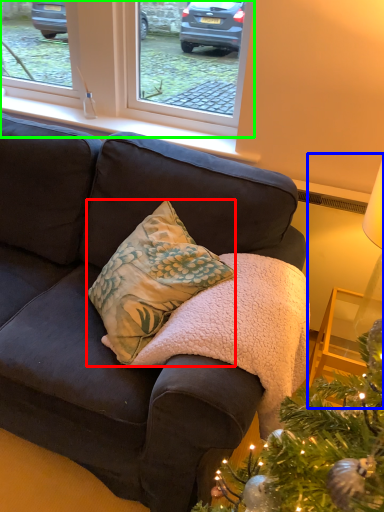
Question: Which object is the closest to the pillow (highlighted by a red box)? Choose among these: table lamp (highlighted by a blue box) or window (highlighted by a green box).

Choices:
 (A) table lamp
 (B) window

Answer: (A)